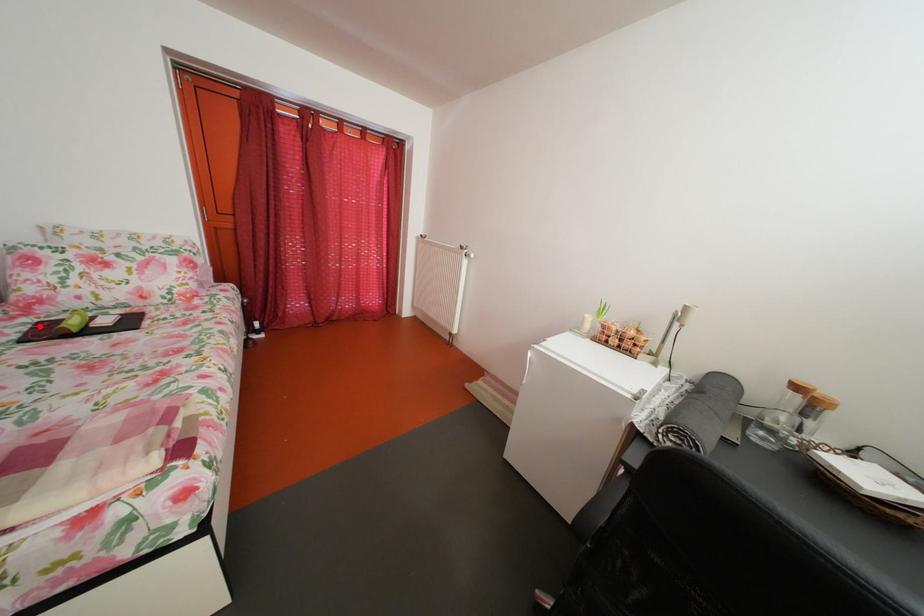
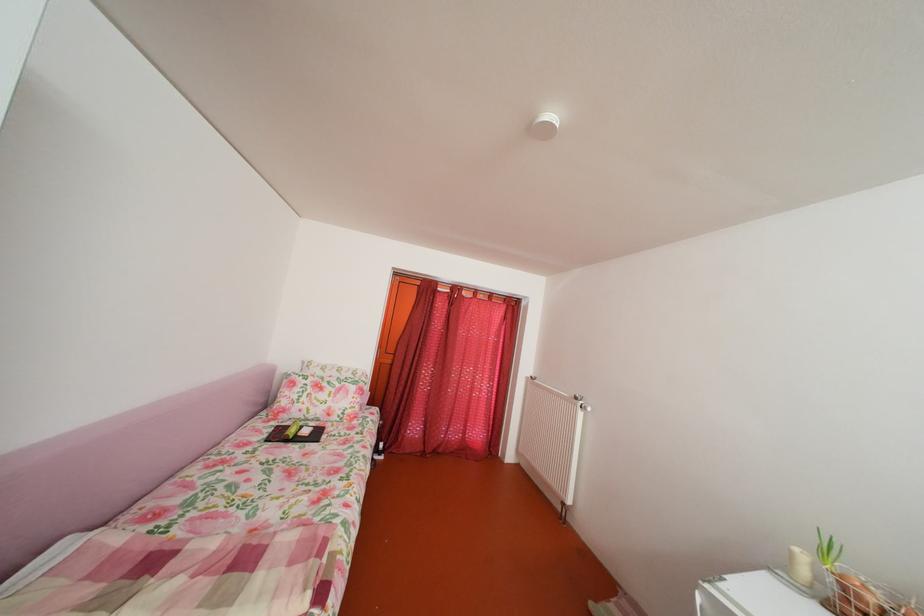
Question: I am providing you with two images of the same scene from different viewpoints. A red point is shown in image1. For the corresponding object point in image2, is it positioned nearer or farther from the camera?

Choices:
 (A) Nearer
 (B) Farther

Answer: (B)